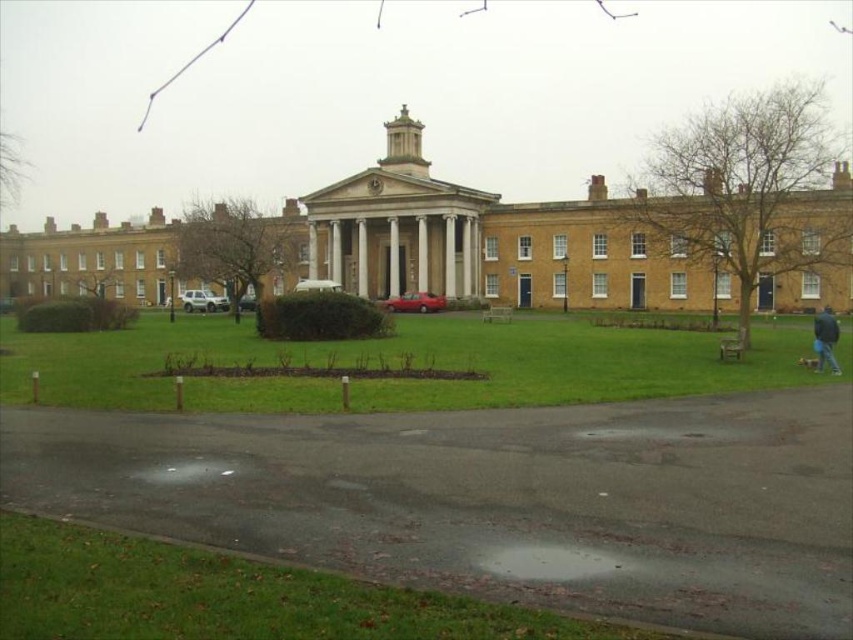
Question: Among these points, which one is farthest from the camera?

Choices:
 (A) (817, 326)
 (B) (16, 355)
 (C) (131, 586)

Answer: (B)

Question: Is green grass at lower center wider than blue fabric jacket at lower right?

Choices:
 (A) yes
 (B) no

Answer: (A)

Question: Can you confirm if green grass at lower left is positioned to the right of blue fabric jacket at lower right?

Choices:
 (A) yes
 (B) no

Answer: (B)

Question: Estimate the real-world distances between objects in this image. Which object is farther from the green grass at lower center?

Choices:
 (A) blue fabric jacket at lower right
 (B) green grass at lower left

Answer: (B)

Question: Is green grass at lower center positioned before blue fabric jacket at lower right?

Choices:
 (A) yes
 (B) no

Answer: (A)

Question: Estimate the real-world distances between objects in this image. Which object is closer to the green grass at lower left?

Choices:
 (A) blue fabric jacket at lower right
 (B) green grass at lower center

Answer: (A)